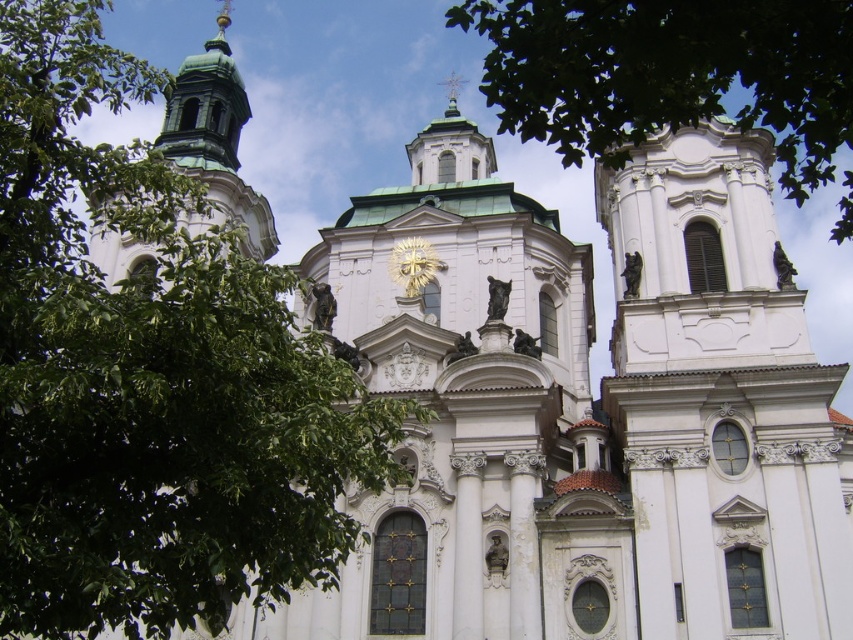
Does point (85, 342) lie in front of point (207, 145)?

Yes, it is in front of point (207, 145).

Which is behind, point (189, 257) or point (230, 161)?

The point (230, 161) is behind.

In order to click on green leafy tree at upper left in this screenshot , I will do `click(149, 376)`.

Is green leafy tree at upper center taller than gold metallic clock at center?

Yes.

Is point (509, 83) farther from viewer compared to point (426, 241)?

No.

Where is `green leafy tree at upper center`? The height and width of the screenshot is (640, 853). green leafy tree at upper center is located at coordinates (669, 74).

Who is shorter, green leafy tree at upper center or green polished dome at upper left?

green polished dome at upper left

Does green leafy tree at upper center have a greater height compared to green polished dome at upper left?

Correct, green leafy tree at upper center is much taller as green polished dome at upper left.

Locate an element on the screen. The image size is (853, 640). green leafy tree at upper center is located at coordinates (669, 74).